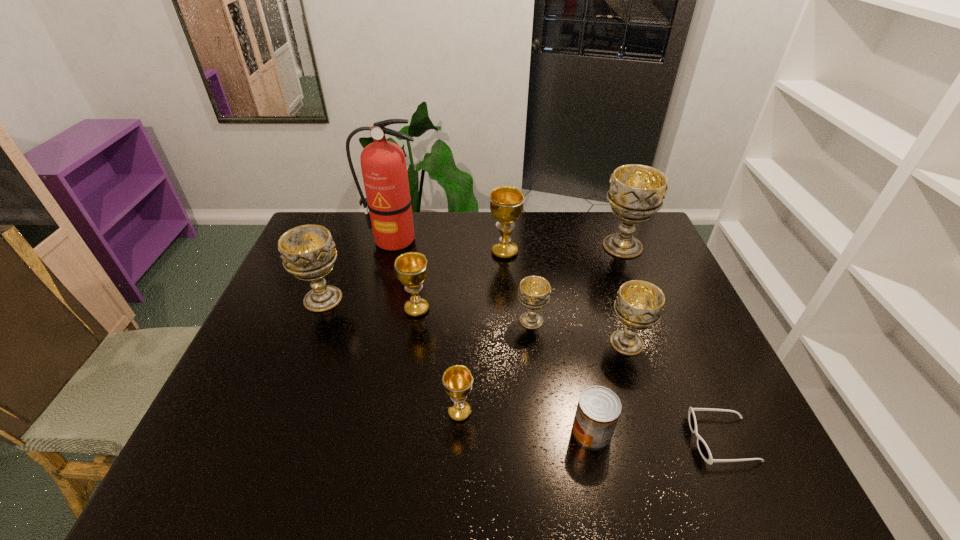
I want to click on the leftmost gold chalice, so click(411, 267).

The width and height of the screenshot is (960, 540). I want to click on the smallest white chalice, so click(534, 292).

The image size is (960, 540). Identify the location of the second gold chalice from right to left. (457, 380).

You are a GUI agent. You are given a task and a screenshot of the screen. Output one action in this format:
    pyautogui.click(x=<x>, y=<y>)
    Task: Click on the nearest gold chalice
    The height and width of the screenshot is (540, 960).
    Given the screenshot: What is the action you would take?
    pyautogui.click(x=457, y=380)

Image resolution: width=960 pixels, height=540 pixels. Identify the location of the seventh object from left to right. (598, 410).

Image resolution: width=960 pixels, height=540 pixels. What are the coordinates of `red can` in the screenshot? It's located at (598, 410).

I want to click on black sunglasses, so click(701, 444).

In order to click on the shortest object in this screenshot , I will do click(x=701, y=444).

The width and height of the screenshot is (960, 540). In order to click on free space located on the side of the tallest object with the nozzle and handle in this screenshot , I will do `click(379, 299)`.

What are the coordinates of `free location located on the front of the tallest chalice` in the screenshot? It's located at (656, 329).